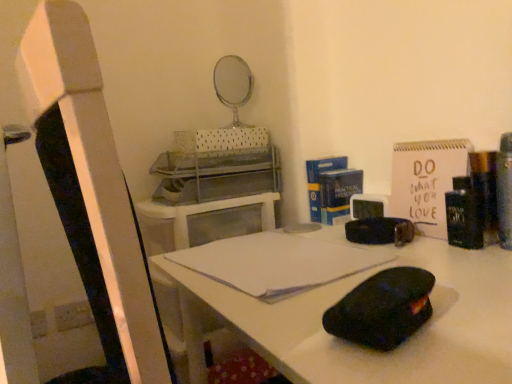
What is the approximate height of white paper notebook at center?

white paper notebook at center is 0.73 inches tall.

The width and height of the screenshot is (512, 384). Describe the element at coordinates (277, 263) in the screenshot. I see `white paper notebook at center` at that location.

Find the location of a particular element. This screenshot has width=512, height=384. white paper notebook at center is located at coordinates (277, 263).

What is the approximate width of black matte desk at center?

black matte desk at center is 23.24 inches in width.

Locate an element on the screen. black matte desk at center is located at coordinates (362, 348).

Image resolution: width=512 pixels, height=384 pixels. Describe the element at coordinates (362, 348) in the screenshot. I see `black matte desk at center` at that location.

Locate an element on the screen. white paper notebook at center is located at coordinates (277, 263).

Would you say white paper notebook at center is to the left or to the right of black matte desk at center in the picture?

Based on their positions, white paper notebook at center is located to the left of black matte desk at center.

In the scene shown: Does white paper notebook at center come behind black matte desk at center?

Yes, white paper notebook at center is further from the viewer.

Considering the points (232, 273) and (346, 353), which point is in front, point (232, 273) or point (346, 353)?

Point (346, 353)

From the image's perspective, is white paper notebook at center above or below black matte desk at center?

white paper notebook at center is above black matte desk at center.

From a real-world perspective, is white paper notebook at center under black matte desk at center?

No, from a real-world perspective, white paper notebook at center is not under black matte desk at center.

Is white paper notebook at center thinner than black matte desk at center?

Yes.

Is white paper notebook at center shorter than black matte desk at center?

Indeed, white paper notebook at center has a lesser height compared to black matte desk at center.

Which of these two, white paper notebook at center or black matte desk at center, is smaller?

white paper notebook at center is smaller.

Is white paper notebook at center spatially inside black matte desk at center, or outside of it?

white paper notebook at center is spatially positioned inside black matte desk at center.

Can you see white paper notebook at center touching black matte desk at center?

No, white paper notebook at center is not making contact with black matte desk at center.

Is white paper notebook at center looking in the opposite direction of black matte desk at center?

Yes, white paper notebook at center is facing away from black matte desk at center.

What's the angular difference between white paper notebook at center and black matte desk at center's facing directions?

white paper notebook at center and black matte desk at center are facing 6.76 degrees away from each other.

Measure the distance from white paper notebook at center to black matte desk at center.

white paper notebook at center and black matte desk at center are 4.33 inches apart.

The height and width of the screenshot is (384, 512). Identify the location of notebook on the left of black matte desk at center. (277, 263).

Based on the photo, between black matte desk at center and white paper notebook at center, which one appears on the right side from the viewer's perspective?

From the viewer's perspective, black matte desk at center appears more on the right side.

Which object is closer to the camera taking this photo, black matte desk at center or white paper notebook at center?

black matte desk at center is in front.

Considering the points (353, 349) and (290, 250), which point is behind, point (353, 349) or point (290, 250)?

The point (290, 250) is farther from the camera.

Looking at this image, from the image's perspective, between black matte desk at center and white paper notebook at center, who is located below?

black matte desk at center.

From a real-world perspective, does black matte desk at center stand above white paper notebook at center?

Actually, black matte desk at center is physically below white paper notebook at center in the real world.

In the scene shown: Is black matte desk at center wider or thinner than white paper notebook at center?

Considering their sizes, black matte desk at center looks broader than white paper notebook at center.

Based on the photo, considering the relative sizes of black matte desk at center and white paper notebook at center in the image provided, is black matte desk at center taller than white paper notebook at center?

Indeed, black matte desk at center has a greater height compared to white paper notebook at center.

Considering the sizes of objects black matte desk at center and white paper notebook at center in the image provided, who is bigger, black matte desk at center or white paper notebook at center?

Bigger between the two is black matte desk at center.

Is black matte desk at center not within white paper notebook at center?

Indeed, black matte desk at center is completely outside white paper notebook at center.

In the scene shown: Is there a large distance between black matte desk at center and white paper notebook at center?

No, black matte desk at center is not far from white paper notebook at center.

Is black matte desk at center facing towards white paper notebook at center?

No, black matte desk at center is not turned towards white paper notebook at center.

Locate an element on the screen. The height and width of the screenshot is (384, 512). notebook above the black matte desk at center (from the image's perspective) is located at coordinates (277, 263).

Where is `desk below the white paper notebook at center (from a real-world perspective)`? The height and width of the screenshot is (384, 512). desk below the white paper notebook at center (from a real-world perspective) is located at coordinates (362, 348).

Find the location of a particular element. The height and width of the screenshot is (384, 512). notebook behind the black matte desk at center is located at coordinates (277, 263).